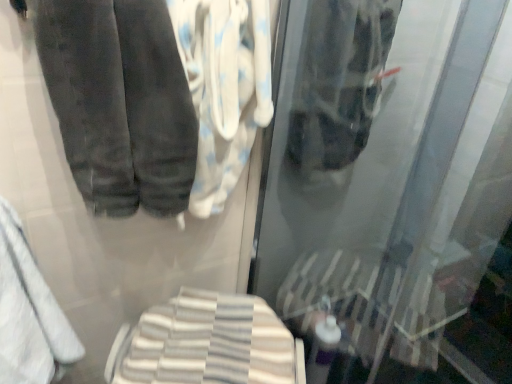
Question: From a real-world perspective, is white cotton towel at center, placed as the second cloth when sorted from bottom to top, above or below white striped towel at lower center, the 2th cloth from the top?

Choices:
 (A) above
 (B) below

Answer: (A)

Question: Is white cotton towel at center, acting as the first cloth starting from the top, taller or shorter than white striped towel at lower center, the 2th cloth from the top?

Choices:
 (A) tall
 (B) short

Answer: (A)

Question: Which object is the farthest from the white soft towel at lower left?

Choices:
 (A) white cotton towel at center, acting as the first cloth starting from the top
 (B) dark gray velvety trousers at upper left
 (C) white striped towel at lower center, which ranks as the 1th cloth in bottom-to-top order
 (D) transparent glass shower door at center

Answer: (D)

Question: Estimate the real-world distances between objects in this image. Which object is farther from the white soft towel at lower left?

Choices:
 (A) white striped towel at lower center, which ranks as the 1th cloth in bottom-to-top order
 (B) transparent glass shower door at center
 (C) dark gray velvety trousers at upper left
 (D) white cotton towel at center, acting as the first cloth starting from the top

Answer: (B)